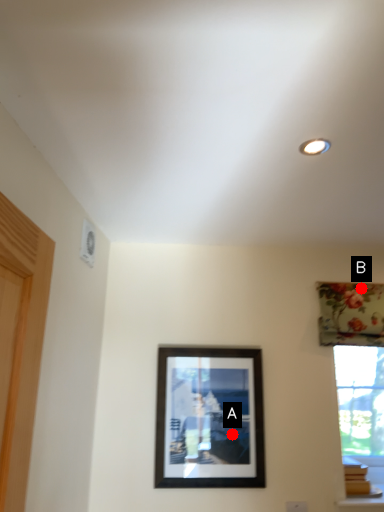
Question: Two points are circled on the image, labeled by A and B beside each circle. Which point appears closest to the camera in this image?

Choices:
 (A) A is closer
 (B) B is closer

Answer: (A)